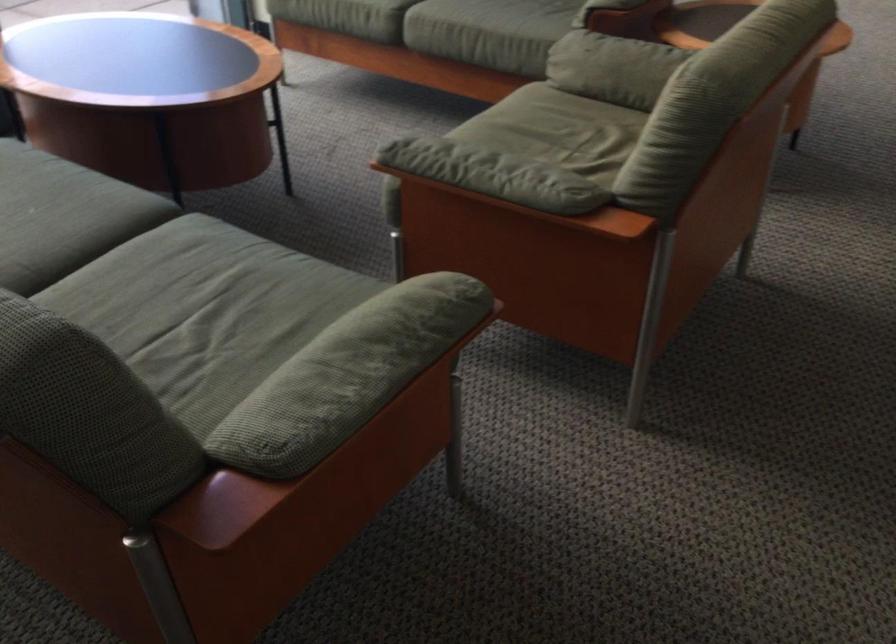
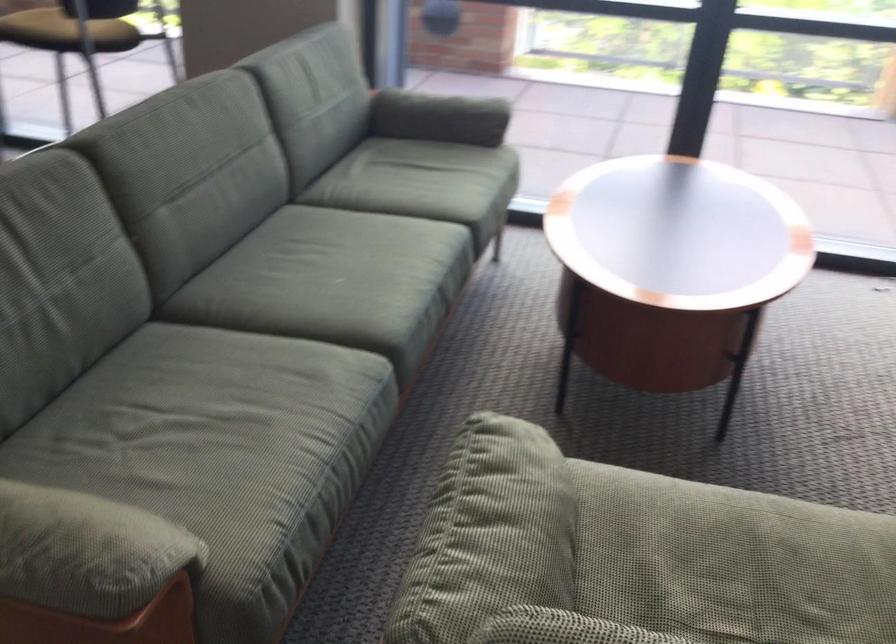
Find the pixel in the second image that matches point (444, 299) in the first image.

(82, 552)